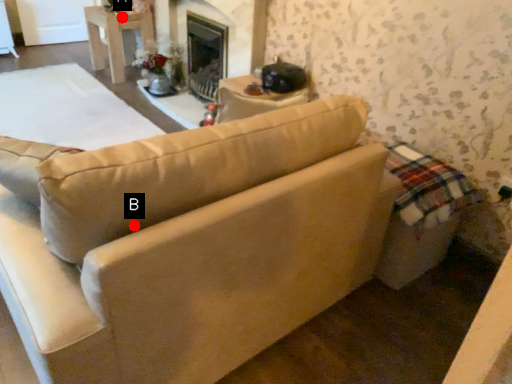
Question: Two points are circled on the image, labeled by A and B beside each circle. Which point is closer to the camera taking this photo?

Choices:
 (A) A is closer
 (B) B is closer

Answer: (B)